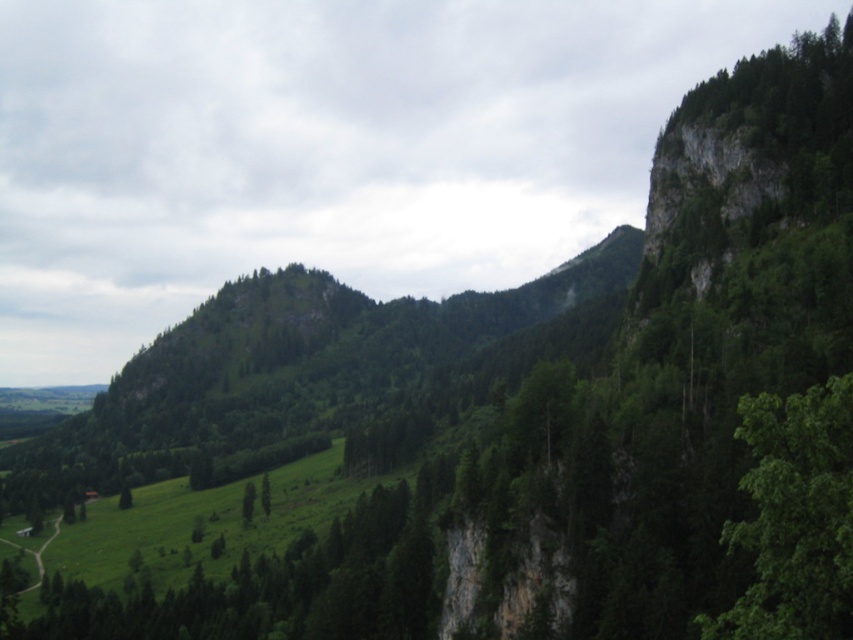
Is point (838, 596) more distant than point (248, 493)?

No, it is in front of (248, 493).

Locate an element on the screen. green leafy tree at right is located at coordinates (793, 516).

Who is higher up, green leafy tree at right or green matte tree at center?

green leafy tree at right

Is green leafy tree at right shorter than green matte tree at center?

Incorrect, green leafy tree at right's height does not fall short of green matte tree at center's.

The image size is (853, 640). I want to click on green leafy tree at right, so click(793, 516).

Is green leafy tree at lower center below green matte tree at center?

Correct, green leafy tree at lower center is located below green matte tree at center.

Which is more to the left, green leafy tree at lower center or green matte tree at center?

green leafy tree at lower center is more to the left.

Locate an element on the screen. The height and width of the screenshot is (640, 853). green leafy tree at lower center is located at coordinates (247, 502).